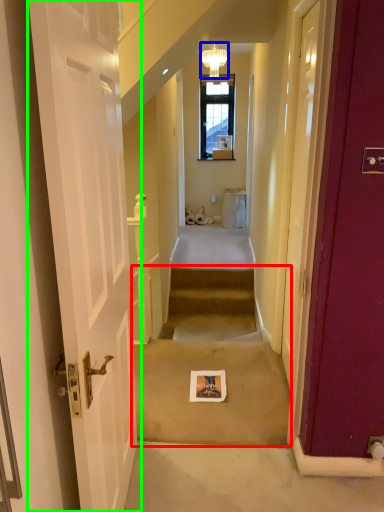
Question: Based on their relative distances, which object is nearer to stairwell (highlighted by a red box)? Choose from light fixture (highlighted by a blue box) and door (highlighted by a green box).

Choices:
 (A) light fixture
 (B) door

Answer: (B)